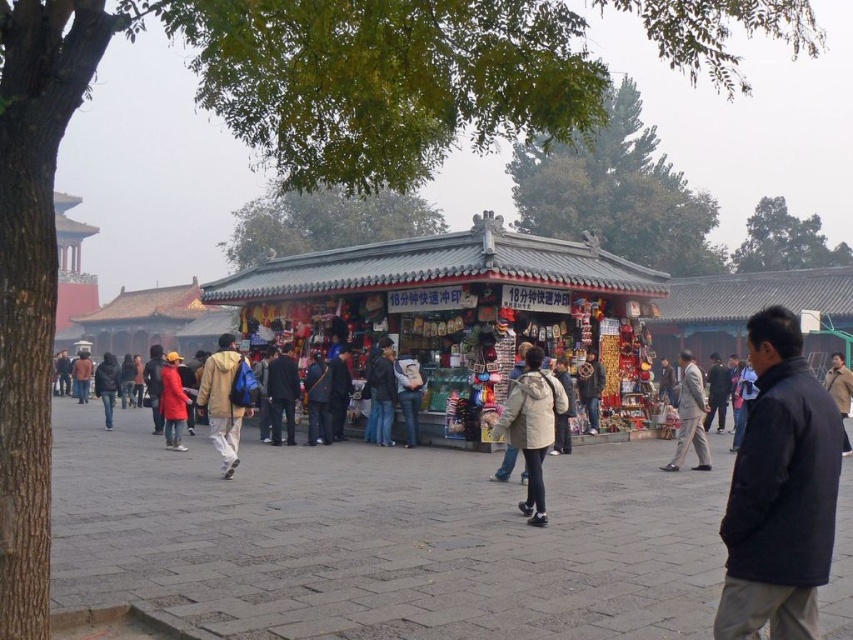
You are a customer at the market and want to buy both the light brown suit at center and the dark gray jacket at center. You notice they are placed in a specific arrangement. Which one is positioned to the right side from your perspective?

The light brown suit at center is positioned to the right of the dark gray jacket at center.

You are a customer in this market and want to try on the light brown suit at center and dark gray jacket at center. However, the fitting room is narrow, only 1 meter wide. Which item can you try on without the garment exceeding the fitting room width?

The dark gray jacket at center can be tried on in the fitting room since its width is narrower than the light brown suit at center, which is wider than the 1 meter width of the fitting room.

You are a tourist standing in the market and want to buy a souvenir from the shop. You see the black matte jacket at lower right nearby. Can you reach the shop within 5 meters from your current position?

The black matte jacket at lower right is 3.82 meters away from you, so yes, you can reach the shop within 5 meters from your current position.